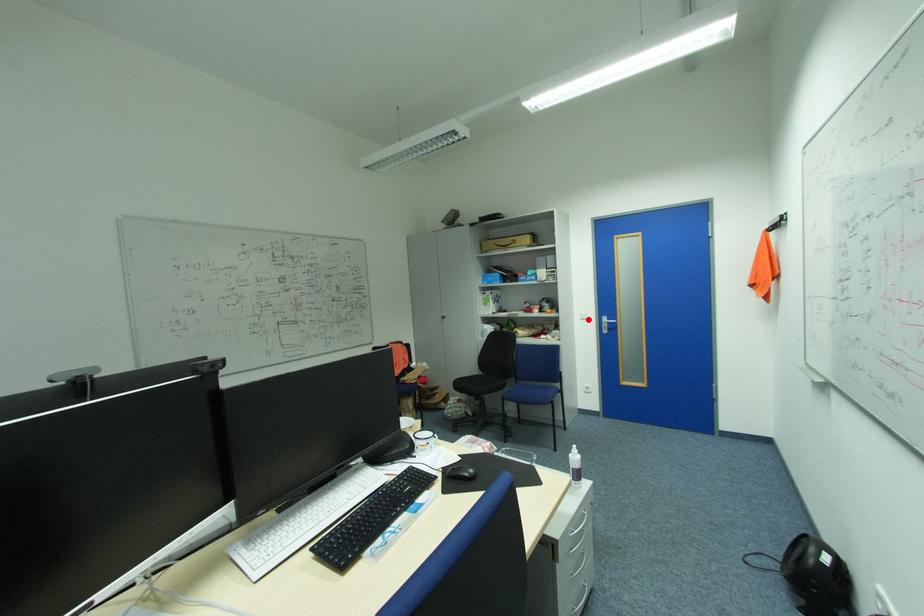
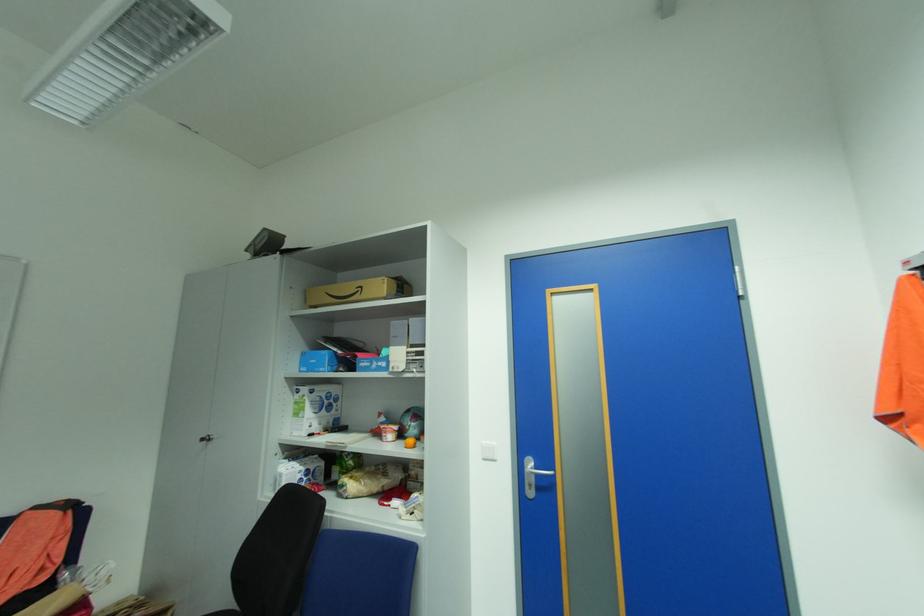
Question: I am providing you with two images of the same scene from different viewpoints. A red point is marked on the first image. Is the red point's position out of view in image 2?

Choices:
 (A) Yes
 (B) No

Answer: (B)